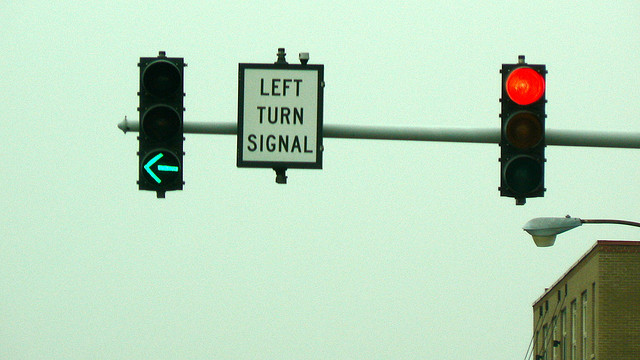
At what (x,y) coordinates should I click in order to perform the action: click on window. Please return your answer as a coordinate pair (x, y). The image size is (640, 360). Looking at the image, I should click on (537, 339), (545, 335), (556, 327), (562, 323), (576, 316), (580, 313), (591, 314).